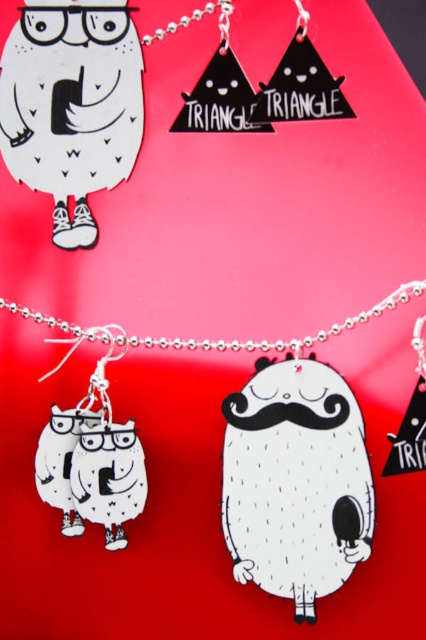
Question: Which point appears closest to the camera in this image?

Choices:
 (A) (8, 301)
 (B) (17, 106)
 (C) (60, 429)

Answer: (B)

Question: Which point is farther from the camera taking this photo?

Choices:
 (A) (103, 337)
 (B) (66, 456)
 (C) (198, 12)

Answer: (A)

Question: Does white matte owl at center have a larger size compared to matte black owl at lower left?

Choices:
 (A) no
 (B) yes

Answer: (B)

Question: Which point is farther to the camera?

Choices:
 (A) 135,113
 (B) 123,451
 (C) 233,524
 (D) 71,435

Answer: (A)

Question: Can you confirm if silver metallic chain at center is positioned below silver metallic chain at upper left?

Choices:
 (A) no
 (B) yes

Answer: (B)

Question: Does silver metallic chain at center have a smaller size compared to silver metallic chain at upper left?

Choices:
 (A) yes
 (B) no

Answer: (B)